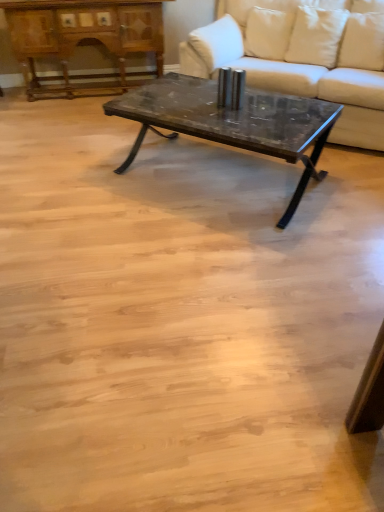
Image resolution: width=384 pixels, height=512 pixels. Find the location of `free space in front of wooden polished dresser at upper left`. free space in front of wooden polished dresser at upper left is located at coordinates (70, 128).